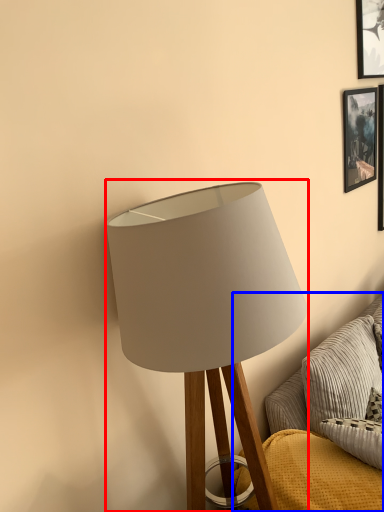
Question: Which object appears farthest to the camera in this image, lamp (highlighted by a red box) or couch (highlighted by a blue box)?

Choices:
 (A) lamp
 (B) couch

Answer: (B)